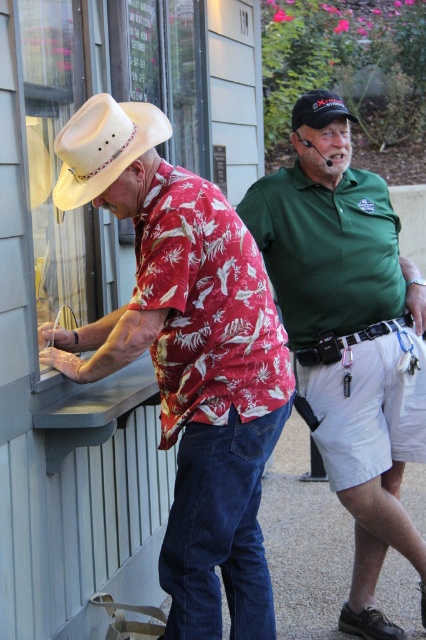
You are a security guard at the venue. You need to ensure that the matte white cowboy hat at left and the black leather belt at center do not block the camera feed. Which object is wider and might be causing an obstruction?

The matte white cowboy hat at left is wider than the black leather belt at center, so it might be causing the obstruction.

You are a customer at a ticket counter and see the matte white cowboy hat at left and the black leather belt at center. Which object is taller?

The matte white cowboy hat at left is taller than the black leather belt at center.